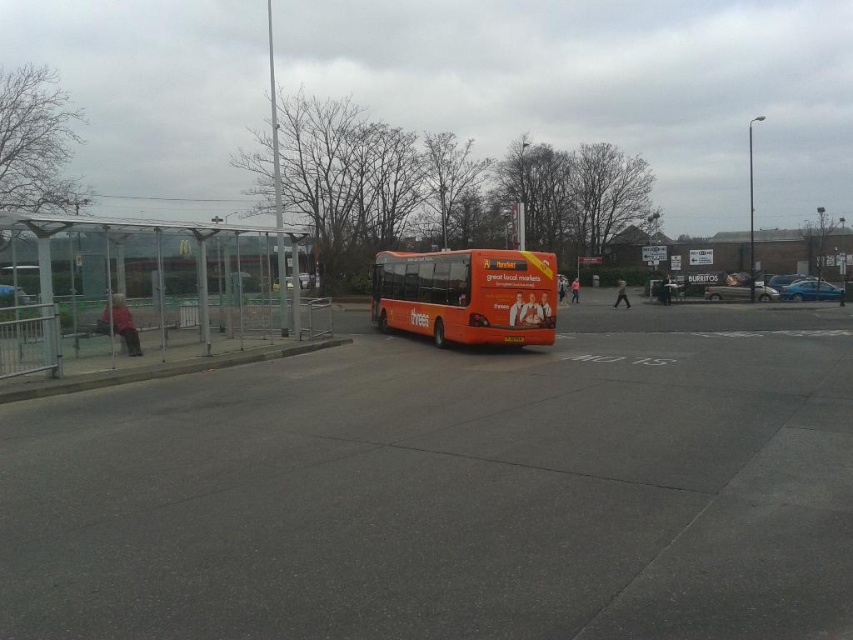
Is concrete pavement at center positioned at the back of transparent glass bus stop at left?

No, it is in front of transparent glass bus stop at left.

Where is `concrete pavement at center`? The height and width of the screenshot is (640, 853). concrete pavement at center is located at coordinates (451, 490).

Between transparent glass bus stop at left and gray concrete curb at lower left, which one has more height?

transparent glass bus stop at left is taller.

Measure the distance from transparent glass bus stop at left to gray concrete curb at lower left.

→ transparent glass bus stop at left is 2.08 meters away from gray concrete curb at lower left.

This screenshot has width=853, height=640. In order to click on transparent glass bus stop at left in this screenshot , I will do `click(142, 289)`.

Can you confirm if transparent glass bus stop at left is positioned below orange matte/decorative bus at center?

Correct, transparent glass bus stop at left is located below orange matte/decorative bus at center.

Which is above, transparent glass bus stop at left or orange matte/decorative bus at center?

orange matte/decorative bus at center

This screenshot has width=853, height=640. Identify the location of transparent glass bus stop at left. [x=142, y=289].